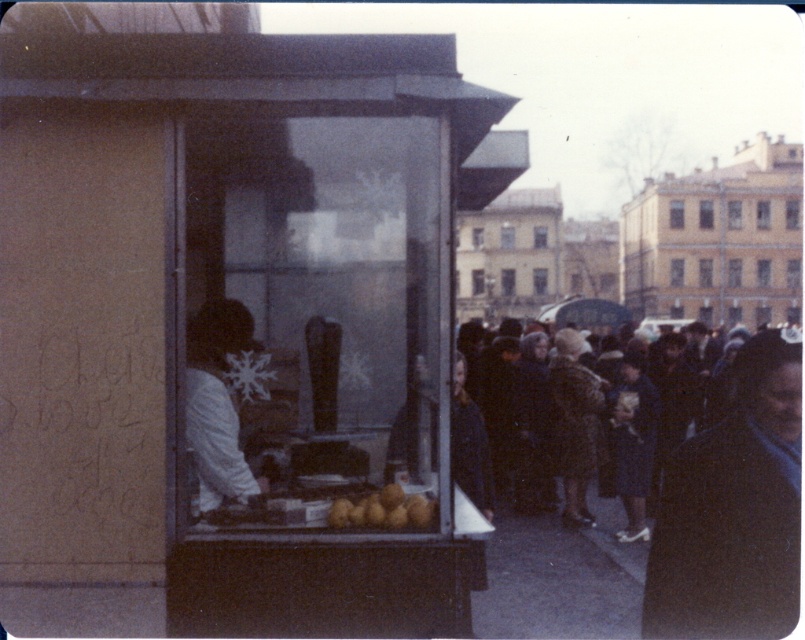
Question: Among these objects, which one is farthest from the camera?

Choices:
 (A) yellow matte potatoes at center
 (B) dark gray coat at center
 (C) dark wool coat at right

Answer: (B)

Question: Can you confirm if patterned fabric coat at center is smaller than dark gray coat at center?

Choices:
 (A) no
 (B) yes

Answer: (A)

Question: Is patterned fabric coat at center bigger than dark gray coat at center?

Choices:
 (A) yes
 (B) no

Answer: (A)

Question: Is patterned fabric coat at center thinner than yellow matte potatoes at center?

Choices:
 (A) no
 (B) yes

Answer: (A)

Question: Which object is the closest to the patterned fabric coat at center?

Choices:
 (A) dark wool coat at right
 (B) dark gray coat at center
 (C) yellow matte potatoes at center

Answer: (B)

Question: Among these points, which one is farthest from the camera?

Choices:
 (A) (465, 480)
 (B) (676, 621)

Answer: (A)